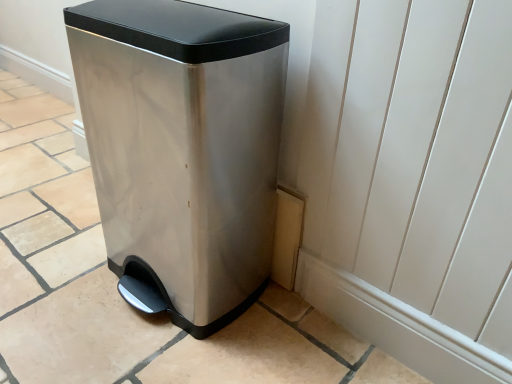
Locate an element on the screen. Image resolution: width=512 pixels, height=384 pixels. vacant space to the left of stainless steel trash can at lower left is located at coordinates (63, 271).